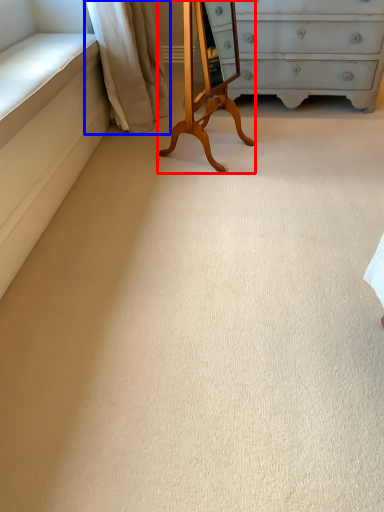
Question: Among these objects, which one is farthest to the camera, changing table (highlighted by a red box) or curtain (highlighted by a blue box)?

Choices:
 (A) changing table
 (B) curtain

Answer: (B)